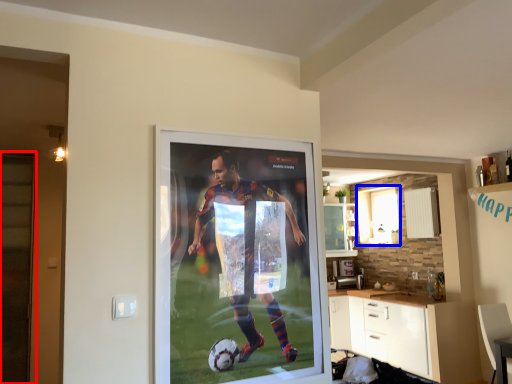
Question: Which of the following is the closest to the observer, screen door (highlighted by a red box) or window (highlighted by a blue box)?

Choices:
 (A) screen door
 (B) window

Answer: (A)